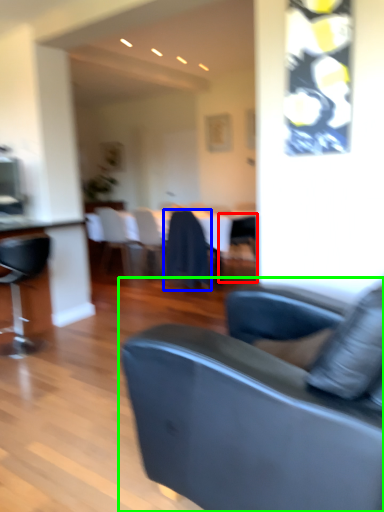
Question: Which object is the closest to the chair (highlighted by a red box)? Choose among these: chair (highlighted by a blue box) or studio couch (highlighted by a green box).

Choices:
 (A) chair
 (B) studio couch

Answer: (A)